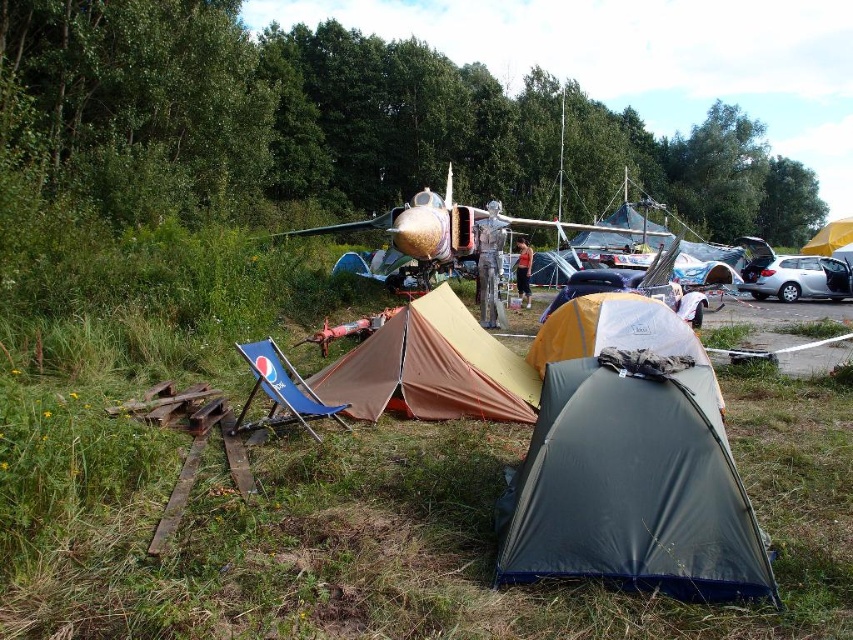
Can you confirm if brown canvas tent at center is wider than silver metallic car at right?

In fact, brown canvas tent at center might be narrower than silver metallic car at right.

Is brown canvas tent at center to the left of silver metallic car at right from the viewer's perspective?

Correct, you'll find brown canvas tent at center to the left of silver metallic car at right.

Does point (459, 374) come farther from viewer compared to point (796, 300)?

That is False.

Identify the location of brown canvas tent at center. The width and height of the screenshot is (853, 640). (431, 369).

Which is below, dark gray tarp at center or brown canvas tent at center?

Positioned lower is dark gray tarp at center.

Is dark gray tarp at center taller than brown canvas tent at center?

No.

This screenshot has width=853, height=640. Find the location of `dark gray tarp at center`. dark gray tarp at center is located at coordinates (631, 488).

Where is `dark gray tarp at center`? dark gray tarp at center is located at coordinates (631, 488).

Can you confirm if brown canvas tent at center is positioned to the right of yellow fabric tent at center?

In fact, brown canvas tent at center is to the left of yellow fabric tent at center.

Who is positioned more to the right, brown canvas tent at center or yellow fabric tent at center?

yellow fabric tent at center is more to the right.

Find the location of a particular element. brown canvas tent at center is located at coordinates (431, 369).